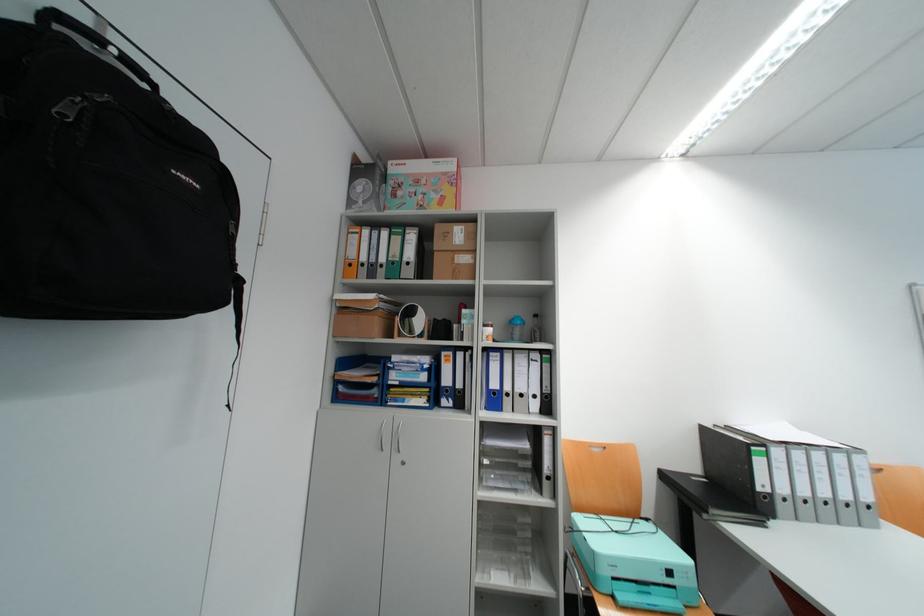
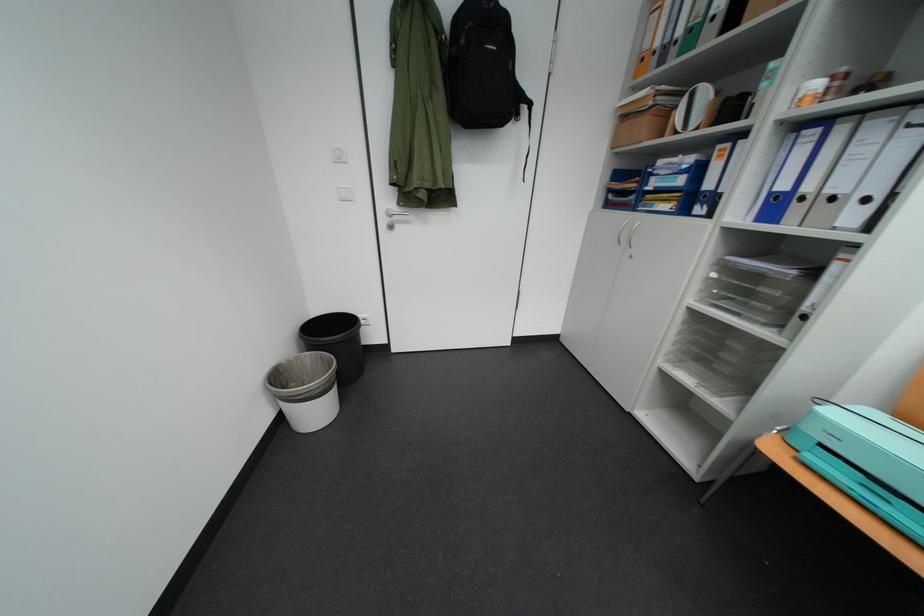
Locate, in the second image, the point that corresponds to [625,580] in the first image.

(833, 447)